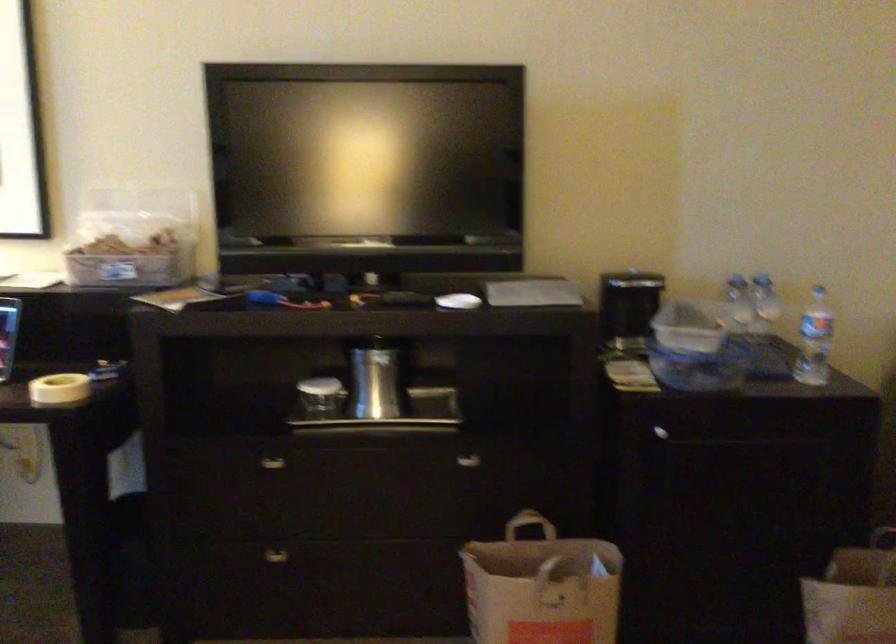
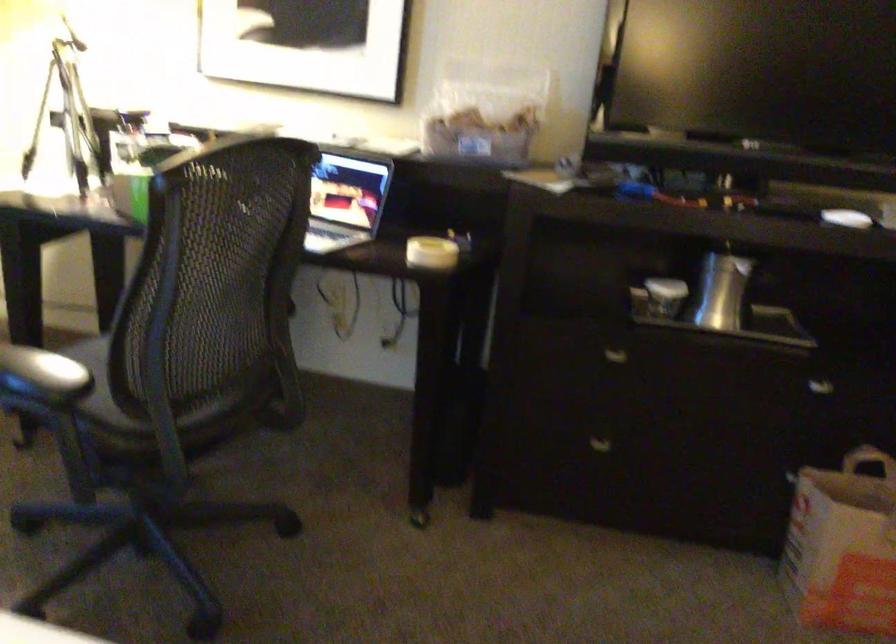
Question: I am providing you with two images of the same scene from different viewpoints. Which of the following objects are not visible in image2?

Choices:
 (A) silver water pitcher
 (B) drawer handle
 (C) paper bag handle
 (D) none of these

Answer: (D)